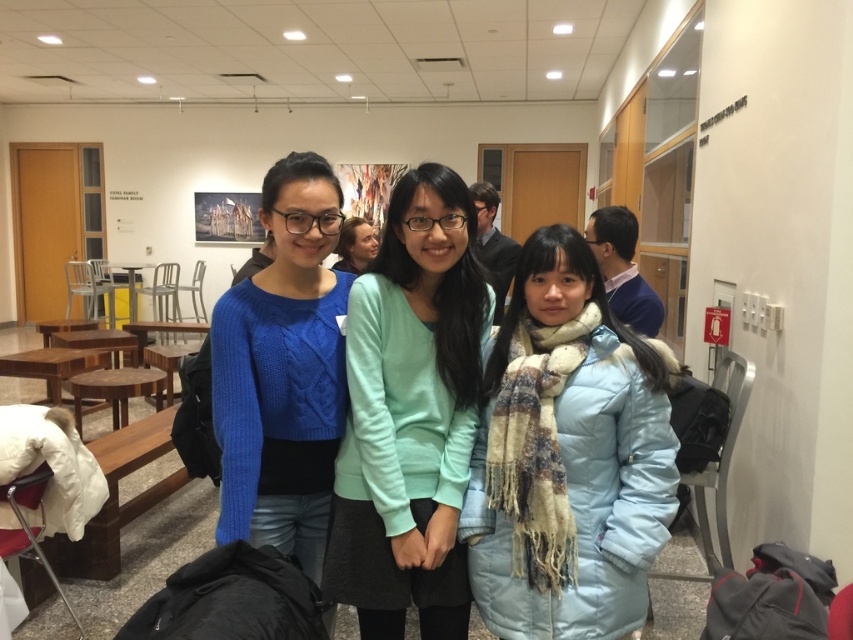
Who is positioned more to the right, mint green sweater at center or matte blue sweater at center?

mint green sweater at center

Does mint green sweater at center appear over matte blue sweater at center?

Actually, mint green sweater at center is below matte blue sweater at center.

Which is in front, point (456, 637) or point (283, 228)?

Point (283, 228)

This screenshot has height=640, width=853. I want to click on mint green sweater at center, so click(410, 416).

Between light blue down jacket at center and mint green sweater at center, which one appears on the left side from the viewer's perspective?

mint green sweater at center

Is light blue down jacket at center wider than mint green sweater at center?

Yes.

The width and height of the screenshot is (853, 640). Identify the location of light blue down jacket at center. (567, 458).

Locate an element on the screen. This screenshot has width=853, height=640. light blue down jacket at center is located at coordinates (567, 458).

Is light blue down jacket at center wider than matte blue sweater at center?

Correct, the width of light blue down jacket at center exceeds that of matte blue sweater at center.

Does point (573, 401) lie in front of point (286, 525)?

Yes, it is.

What are the coordinates of `light blue down jacket at center` in the screenshot? It's located at (567, 458).